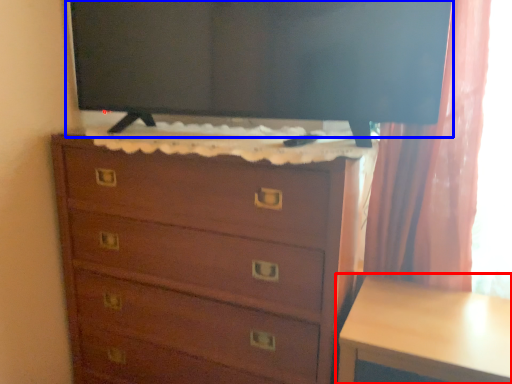
Question: Which point is further to the camera, table (highlighted by a red box) or tv show (highlighted by a blue box)?

Choices:
 (A) table
 (B) tv show

Answer: (B)